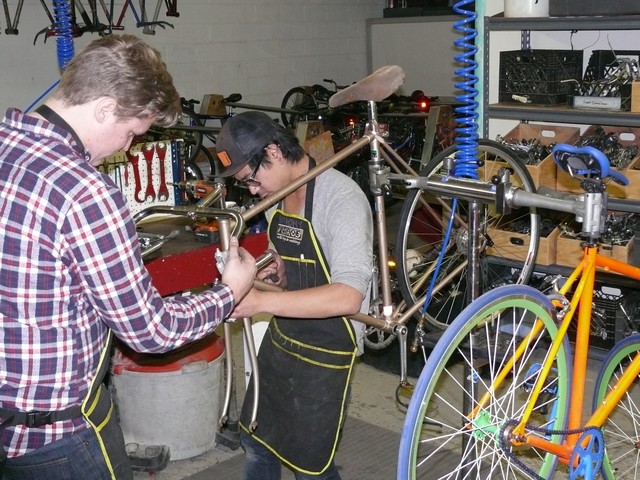
Identify the location of painted brick wall. (273, 62).